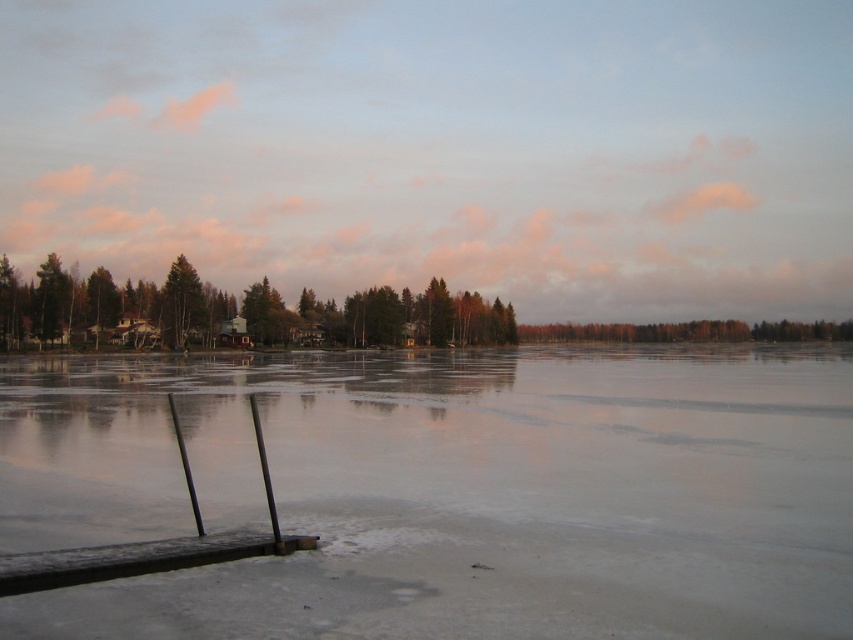
You are an ice skater wanting to glide across the transparent ice at center and the brown wooden dock at lower left. Which surface has a greater width for you to skate on?

The transparent ice at center has a greater width than the brown wooden dock at lower left, so you can skate on the transparent ice at center for a wider path.

You are standing on the brown wooden dock at lower left and want to walk towards the transparent ice at center. In which direction should you move?

You should move to the right to reach the transparent ice at center since it is located to the right of the brown wooden dock at lower left.